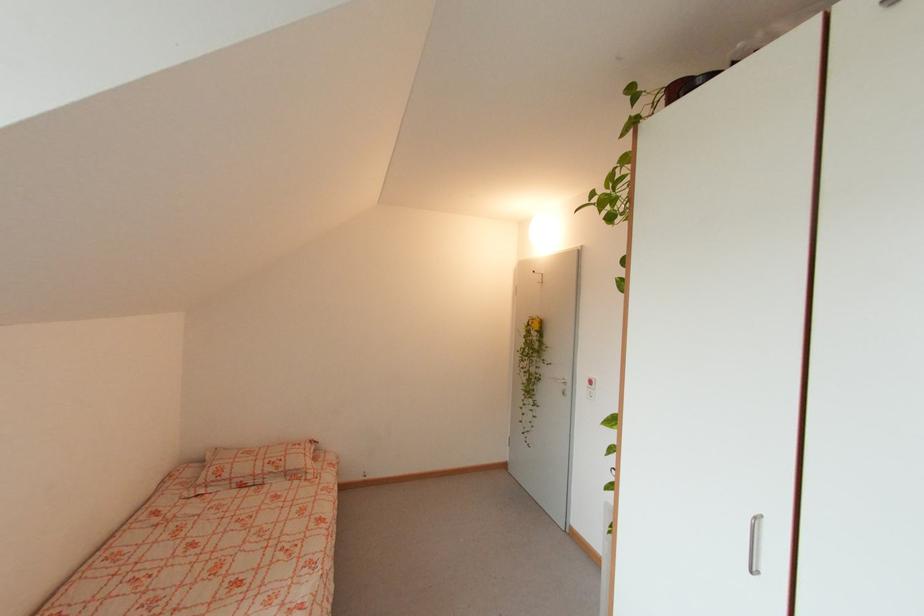
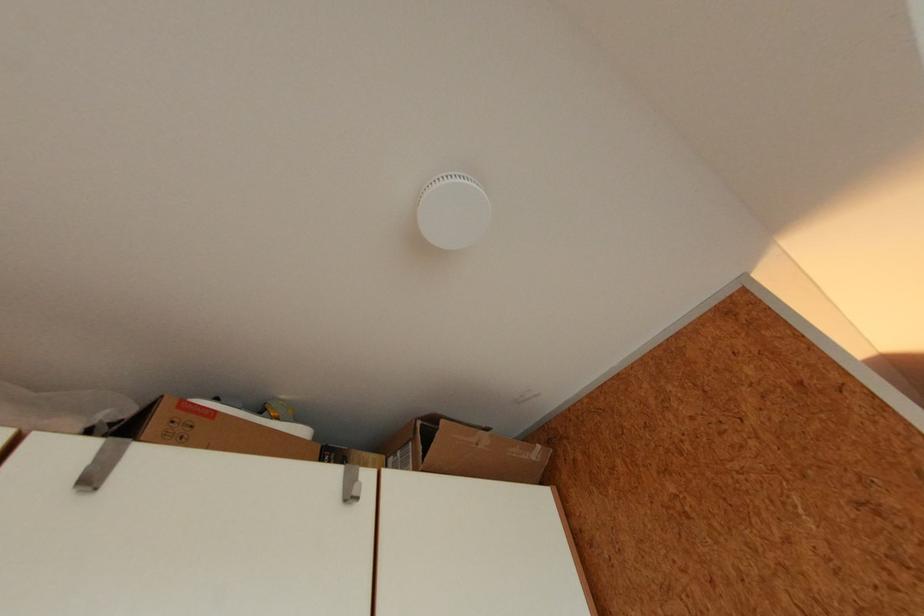
How did the camera likely rotate?

The camera's rotation is toward right-up.